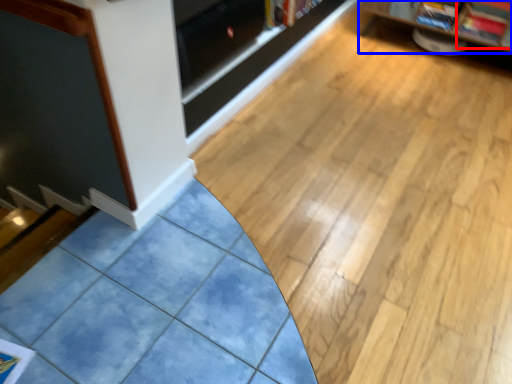
Question: Which object appears closest to the camera in this image, magazine (highlighted by a red box) or shelf (highlighted by a blue box)?

Choices:
 (A) magazine
 (B) shelf

Answer: (B)